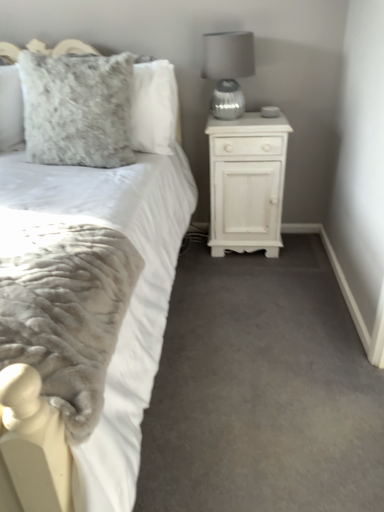
Locate an element on the screen. The height and width of the screenshot is (512, 384). free space in front of white wood nightstand at right is located at coordinates (249, 278).